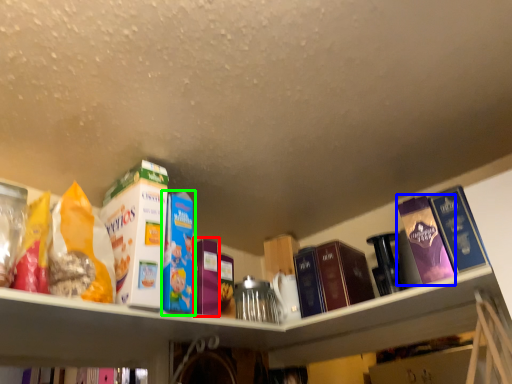
Question: Which is farther away from book (highlighted by a red box)? book (highlighted by a blue box) or book (highlighted by a green box)?

Choices:
 (A) book
 (B) book

Answer: (A)